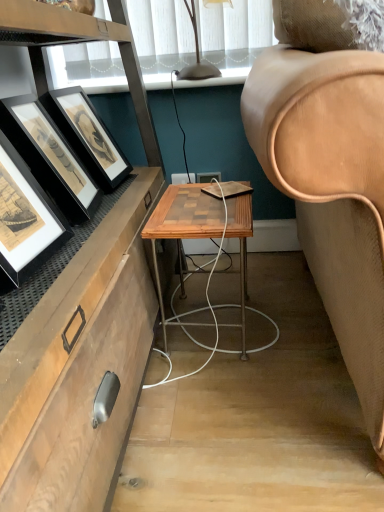
Locate an element on the screen. Image resolution: width=384 pixels, height=512 pixels. vacant area on top of woodenmaterial/texturetable at center (from a real-world perspective) is located at coordinates (209, 206).